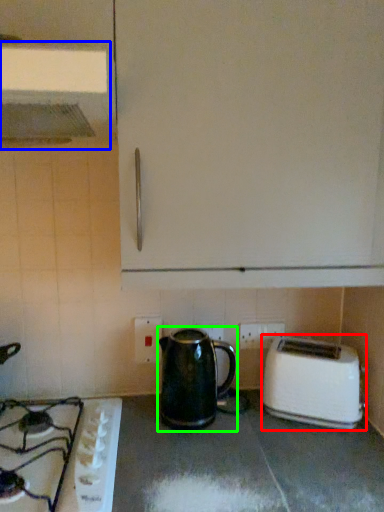
Question: Which object is positioned closest to toaster (highlighted by a red box)? Select from exhaust hood (highlighted by a blue box) and kettle (highlighted by a green box).

Choices:
 (A) exhaust hood
 (B) kettle

Answer: (B)